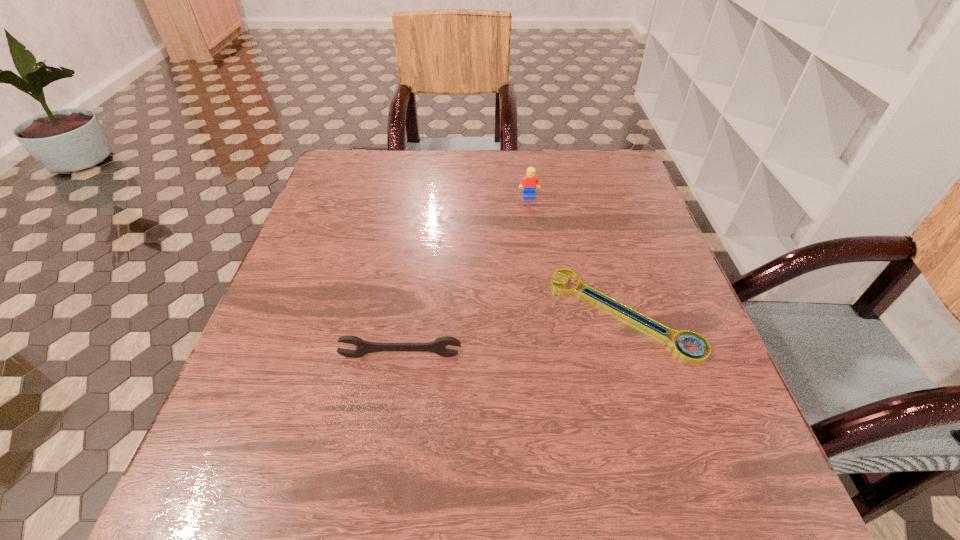
Where is `the farthest object`? This screenshot has width=960, height=540. the farthest object is located at coordinates (528, 183).

Where is `Lego`? Lego is located at coordinates (528, 183).

At what (x,y) coordinates should I click in order to perform the action: click on the taller wrench. Please return your answer as a coordinate pair (x, y). The image size is (960, 540). Looking at the image, I should click on (438, 346).

The image size is (960, 540). What are the coordinates of `the second tallest object` in the screenshot? It's located at (438, 346).

The height and width of the screenshot is (540, 960). I want to click on the shorter wrench, so click(x=618, y=309).

Locate an element on the screen. The height and width of the screenshot is (540, 960). the right wrench is located at coordinates (618, 309).

I want to click on free space located on the face of the Lego, so click(535, 240).

The image size is (960, 540). Find the location of `free space located 0.120m on the open ends of the second shortest object`. free space located 0.120m on the open ends of the second shortest object is located at coordinates (391, 421).

Identify the location of vacant space situated 0.380m on the left of the shorter wrench. The width and height of the screenshot is (960, 540). (358, 314).

Where is `object that is at the far edge`? The height and width of the screenshot is (540, 960). object that is at the far edge is located at coordinates (528, 183).